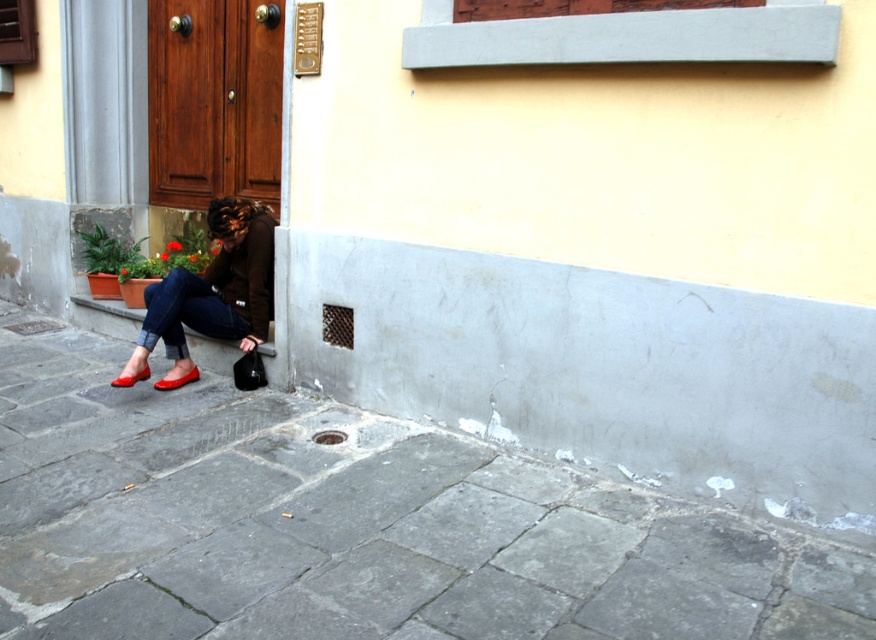
Question: Can you confirm if gray stone pavement at lower left is thinner than matte brown coat at lower left?

Choices:
 (A) no
 (B) yes

Answer: (A)

Question: Among these objects, which one is nearest to the camera?

Choices:
 (A) matte black bag at lower left
 (B) gray stone pavement at lower left
 (C) matte red shoe at lower left

Answer: (B)

Question: Estimate the real-world distances between objects in this image. Which object is farther from the matte black bag at lower left?

Choices:
 (A) shiny red shoe at lower left
 (B) gray stone pavement at lower left
 (C) matte red shoe at lower left
 (D) matte brown coat at lower left

Answer: (B)

Question: Which object appears farthest from the camera in this image?

Choices:
 (A) matte brown coat at lower left
 (B) matte red shoe at lower left
 (C) matte black bag at lower left

Answer: (C)

Question: Is matte brown coat at lower left thinner than shiny red shoe at lower left?

Choices:
 (A) no
 (B) yes

Answer: (A)

Question: Can you confirm if matte black bag at lower left is wider than matte red shoe at lower left?

Choices:
 (A) no
 (B) yes

Answer: (B)